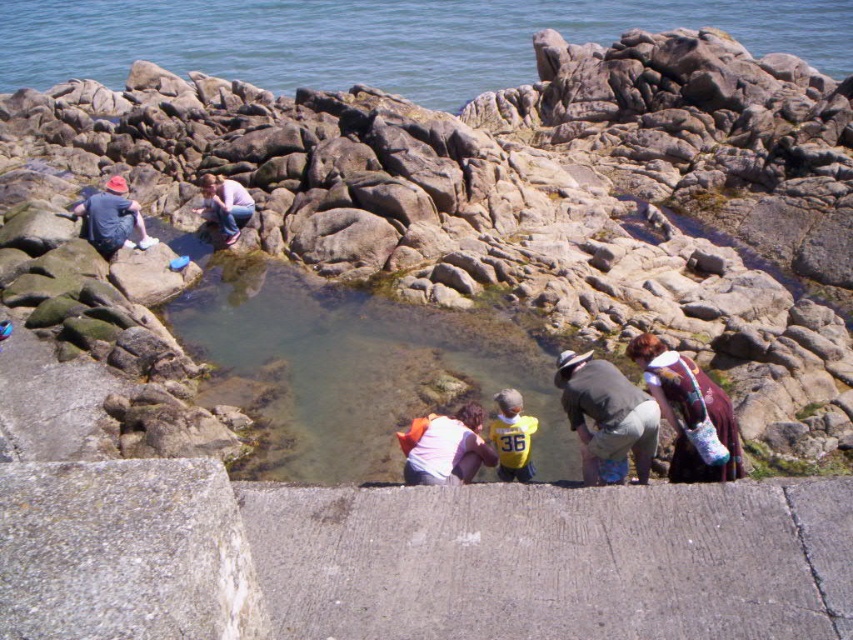
Question: Which object is the closest to the clear water at upper center?

Choices:
 (A) matte blue jeans at upper center
 (B) matte blue shirt at left
 (C) yellow jersey at center

Answer: (A)

Question: Which of the following is the farthest from the observer?

Choices:
 (A) tap(732, 451)
 (B) tap(115, 225)
 (C) tap(583, 428)
 (D) tap(416, 468)

Answer: (B)

Question: From the image, what is the correct spatial relationship of clear water at upper center in relation to knitted sweater at lower right?

Choices:
 (A) right
 (B) left

Answer: (B)

Question: Does knitted sweater at lower right have a smaller size compared to matte blue shirt at left?

Choices:
 (A) no
 (B) yes

Answer: (B)

Question: Can you confirm if rocky at center is wider than matte blue shirt at left?

Choices:
 (A) yes
 (B) no

Answer: (A)

Question: Which point appears closest to the camera in this image?

Choices:
 (A) (131, 228)
 (B) (228, 218)

Answer: (A)